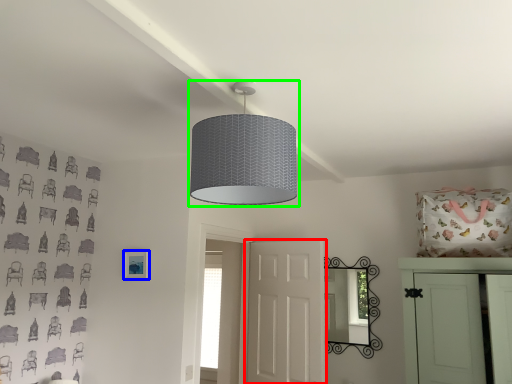
Question: Based on their relative distances, which object is farther from door (highlighted by a red box)? Choose from picture frame (highlighted by a blue box) and lamp (highlighted by a green box).

Choices:
 (A) picture frame
 (B) lamp

Answer: (B)